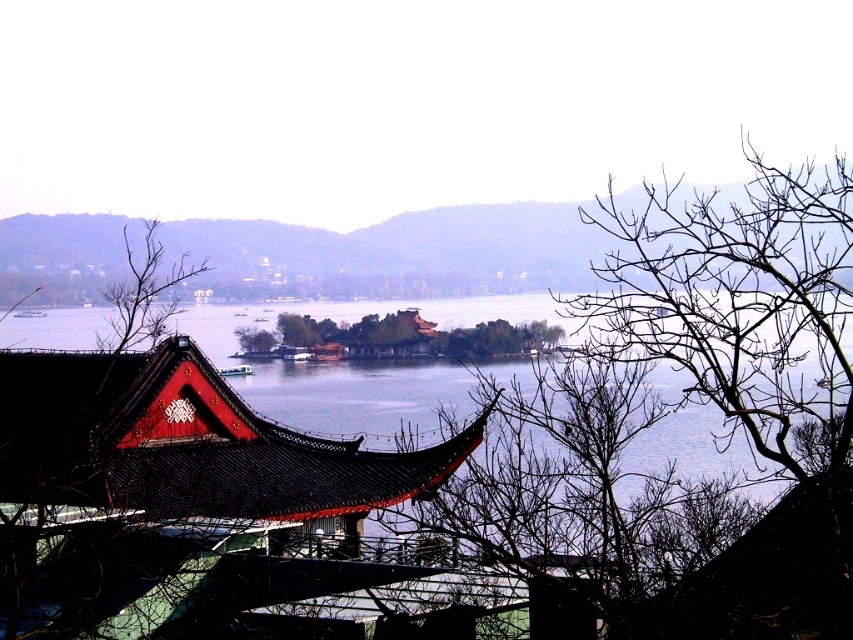
You are an artist sketching the scene and want to draw the green leafy island at center and brown leafless tree at center. Which object should you sketch first to maintain the correct spatial relationship?

You should sketch the green leafy island at center first because it is in front of the brown leafless tree at center, so it should be drawn before the tree to ensure proper layering.

You are an architect designing a new garden layout. You have two elements to place in the center of the garden area. The green leafy island at center and the brown leafless tree at center. Which element should you place first if you want to prioritize the larger feature in the center?

The green leafy island at center is larger in size than the brown leafless tree at center, so you should place the green leafy island at center first to prioritize the larger feature in the center.